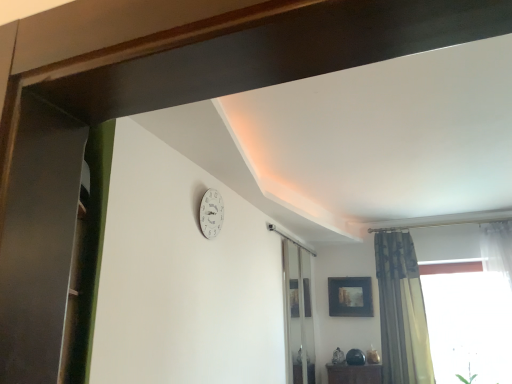
This screenshot has width=512, height=384. What do you see at coordinates (211, 213) in the screenshot?
I see `white matte clock at upper center` at bounding box center [211, 213].

The width and height of the screenshot is (512, 384). Describe the element at coordinates (350, 296) in the screenshot. I see `matte black picture frame at upper center` at that location.

What do you see at coordinates (402, 311) in the screenshot? This screenshot has height=384, width=512. I see `textured beige curtain at right` at bounding box center [402, 311].

Image resolution: width=512 pixels, height=384 pixels. Find the location of `transparent glass screen door at left, positioned as the second screen door in right-to-left order`. transparent glass screen door at left, positioned as the second screen door in right-to-left order is located at coordinates (38, 240).

Between textured beige curtain at right and matte black picture frame at upper center, which one appears on the left side from the viewer's perspective?

From the viewer's perspective, matte black picture frame at upper center appears more on the left side.

The height and width of the screenshot is (384, 512). Identify the location of picture frame positioned vertically above the textured beige curtain at right (from a real-world perspective). (350, 296).

Does textured beige curtain at right turn towards matte black picture frame at upper center?

No.

Considering the relative sizes of textured beige curtain at right and matte black picture frame at upper center in the image provided, is textured beige curtain at right taller than matte black picture frame at upper center?

Indeed, textured beige curtain at right has a greater height compared to matte black picture frame at upper center.

Considering the sizes of transparent glass screen door at left, the 1th screen door viewed from the top, and white matte clock at upper center in the image, is transparent glass screen door at left, the 1th screen door viewed from the top, wider or thinner than white matte clock at upper center?

In the image, transparent glass screen door at left, the 1th screen door viewed from the top, appears to be wider than white matte clock at upper center.

Between point (61, 291) and point (206, 200), which one is positioned behind?

The point (206, 200) is behind.

Is transparent glass screen door at left, which is the 1th screen door in left-to-right order, smaller than white matte clock at upper center?

No.

How much distance is there between transparent glass screen door at left, positioned as the second screen door in right-to-left order, and white matte clock at upper center?

A distance of 5.00 feet exists between transparent glass screen door at left, positioned as the second screen door in right-to-left order, and white matte clock at upper center.

In terms of height, does transparent glass screen door at center, which is the first screen door from bottom to top, look taller or shorter compared to matte black picture frame at upper center?

Considering their sizes, transparent glass screen door at center, which is the first screen door from bottom to top, has more height than matte black picture frame at upper center.

Does transparent glass screen door at center, the 2th screen door viewed from the front, have a larger size compared to matte black picture frame at upper center?

Yes, transparent glass screen door at center, the 2th screen door viewed from the front, is bigger than matte black picture frame at upper center.

Which of these two, transparent glass screen door at center, placed as the second screen door when sorted from left to right, or matte black picture frame at upper center, is thinner?

With smaller width is transparent glass screen door at center, placed as the second screen door when sorted from left to right.

Is transparent glass screen door at center, which appears as the second screen door when viewed from the top, aimed at matte black picture frame at upper center?

No, transparent glass screen door at center, which appears as the second screen door when viewed from the top, is not aimed at matte black picture frame at upper center.

Is white matte clock at upper center taller or shorter than transparent glass screen door at left, the second screen door positioned from the bottom?

In the image, white matte clock at upper center appears to be shorter than transparent glass screen door at left, the second screen door positioned from the bottom.

What's the angular difference between white matte clock at upper center and transparent glass screen door at left, positioned as the second screen door in right-to-left order,'s facing directions?

The angular difference between white matte clock at upper center and transparent glass screen door at left, positioned as the second screen door in right-to-left order, is 31.9 degrees.

Does white matte clock at upper center appear on the right side of transparent glass screen door at left, positioned as the second screen door in right-to-left order?

Correct, you'll find white matte clock at upper center to the right of transparent glass screen door at left, positioned as the second screen door in right-to-left order.

From a real-world perspective, who is located lower, white matte clock at upper center or transparent glass screen door at left, acting as the 2th screen door starting from the back?

transparent glass screen door at left, acting as the 2th screen door starting from the back, from a real-world perspective.

Considering the relative positions of textured beige curtain at right and transparent glass screen door at center, the 1th screen door from the right, in the image provided, is textured beige curtain at right to the left of transparent glass screen door at center, the 1th screen door from the right, from the viewer's perspective?

In fact, textured beige curtain at right is to the right of transparent glass screen door at center, the 1th screen door from the right.

Consider the image. Is textured beige curtain at right positioned with its back to transparent glass screen door at center, placed as the second screen door when sorted from left to right?

textured beige curtain at right does not have its back to transparent glass screen door at center, placed as the second screen door when sorted from left to right.

Is textured beige curtain at right far away from transparent glass screen door at center, the 2th screen door viewed from the front?

No, there isn't a large distance between textured beige curtain at right and transparent glass screen door at center, the 2th screen door viewed from the front.

Is transparent glass screen door at center, which is the first screen door from bottom to top, inside textured beige curtain at right?

That's incorrect, transparent glass screen door at center, which is the first screen door from bottom to top, is not inside textured beige curtain at right.

Is point (208, 206) more distant than point (349, 302)?

No, (208, 206) is in front of (349, 302).

Looking at their sizes, would you say white matte clock at upper center is wider or thinner than matte black picture frame at upper center?

Considering their sizes, white matte clock at upper center looks slimmer than matte black picture frame at upper center.

From a real-world perspective, which is physically below, white matte clock at upper center or matte black picture frame at upper center?

From a 3D spatial view, matte black picture frame at upper center is below.

Does point (1, 261) lie behind point (381, 283)?

No.

From the image's perspective, between transparent glass screen door at left, the second screen door positioned from the bottom, and textured beige curtain at right, who is located below?

textured beige curtain at right is shown below in the image.

How different are the orientations of transparent glass screen door at left, positioned as the second screen door in right-to-left order, and textured beige curtain at right in degrees?

The angle between the facing direction of transparent glass screen door at left, positioned as the second screen door in right-to-left order, and the facing direction of textured beige curtain at right is 124 degrees.

Considering the sizes of objects transparent glass screen door at left, positioned as the second screen door in right-to-left order, and textured beige curtain at right in the image provided, who is thinner, transparent glass screen door at left, positioned as the second screen door in right-to-left order, or textured beige curtain at right?

With smaller width is textured beige curtain at right.

Where is `picture frame lying behind the textured beige curtain at right`? This screenshot has height=384, width=512. picture frame lying behind the textured beige curtain at right is located at coordinates (350, 296).

Locate an element on the screen. This screenshot has height=384, width=512. clock that appears above the transparent glass screen door at left, positioned as the second screen door in right-to-left order (from a real-world perspective) is located at coordinates (211, 213).

From the image, which object appears to be farther from transparent glass screen door at left, positioned as the second screen door in right-to-left order, transparent glass screen door at center, which is the first screen door from bottom to top, or white matte clock at upper center?

The object further to transparent glass screen door at left, positioned as the second screen door in right-to-left order, is transparent glass screen door at center, which is the first screen door from bottom to top.

Considering their positions, is textured beige curtain at right positioned further to white matte clock at upper center than transparent glass screen door at left, which is the 1th screen door in left-to-right order?

The object further to white matte clock at upper center is textured beige curtain at right.

When comparing their distances from matte black picture frame at upper center, does textured beige curtain at right or transparent glass screen door at center, placed as the second screen door when sorted from left to right, seem closer?

Based on the image, textured beige curtain at right appears to be nearer to matte black picture frame at upper center.

From the image, which object appears to be nearer to matte black picture frame at upper center, transparent glass screen door at left, acting as the 2th screen door starting from the back, or white matte clock at upper center?

Among the two, white matte clock at upper center is located nearer to matte black picture frame at upper center.

Considering their positions, is matte black picture frame at upper center positioned closer to textured beige curtain at right than transparent glass screen door at left, positioned as the second screen door in right-to-left order?

The object closer to textured beige curtain at right is matte black picture frame at upper center.

When comparing their distances from white matte clock at upper center, does transparent glass screen door at left, the 1th screen door viewed from the top, or transparent glass screen door at center, which appears as the second screen door when viewed from the top, seem closer?

transparent glass screen door at left, the 1th screen door viewed from the top, lies closer to white matte clock at upper center than the other object.

Looking at the image, which one is located closer to transparent glass screen door at center, placed as the second screen door when sorted from left to right, matte black picture frame at upper center or textured beige curtain at right?

Based on the image, matte black picture frame at upper center appears to be nearer to transparent glass screen door at center, placed as the second screen door when sorted from left to right.

Based on their spatial positions, is transparent glass screen door at center, which is the 1th screen door in back-to-front order, or matte black picture frame at upper center closer to transparent glass screen door at left, which is the 1th screen door in left-to-right order?

The object closer to transparent glass screen door at left, which is the 1th screen door in left-to-right order, is transparent glass screen door at center, which is the 1th screen door in back-to-front order.

Locate an element on the screen. This screenshot has height=384, width=512. screen door between transparent glass screen door at left, the second screen door positioned from the bottom, and textured beige curtain at right from front to back is located at coordinates click(x=298, y=314).

You are a GUI agent. You are given a task and a screenshot of the screen. Output one action in this format:
    pyautogui.click(x=<x>, y=<y>)
    Task: Click on the clock between transparent glass screen door at left, the 1th screen door positioned from the front, and textured beige curtain at right from front to back
    The width and height of the screenshot is (512, 384).
    Given the screenshot: What is the action you would take?
    pyautogui.click(x=211, y=213)

Identify the location of clock located between transparent glass screen door at left, the 1th screen door positioned from the front, and transparent glass screen door at center, which is the 1th screen door in back-to-front order, in the depth direction. This screenshot has height=384, width=512. (211, 213).

The image size is (512, 384). I want to click on curtain located between white matte clock at upper center and matte black picture frame at upper center in the depth direction, so click(x=402, y=311).